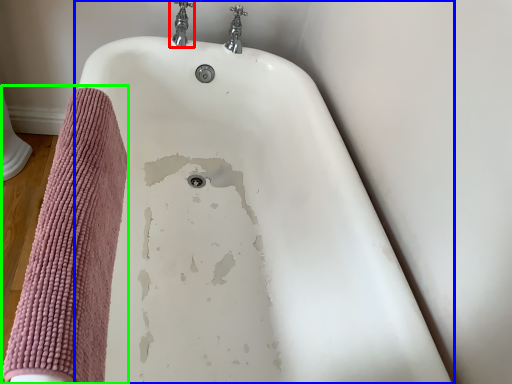
Question: Based on their relative distances, which object is farther from tap (highlighted by a red box)? Choose from bathtub (highlighted by a blue box) and bath towel (highlighted by a green box).

Choices:
 (A) bathtub
 (B) bath towel

Answer: (B)